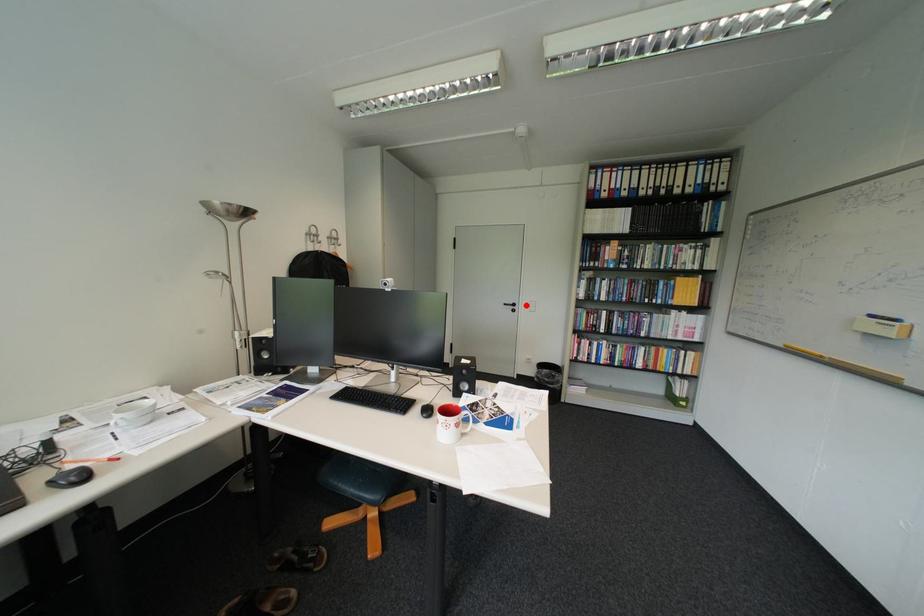
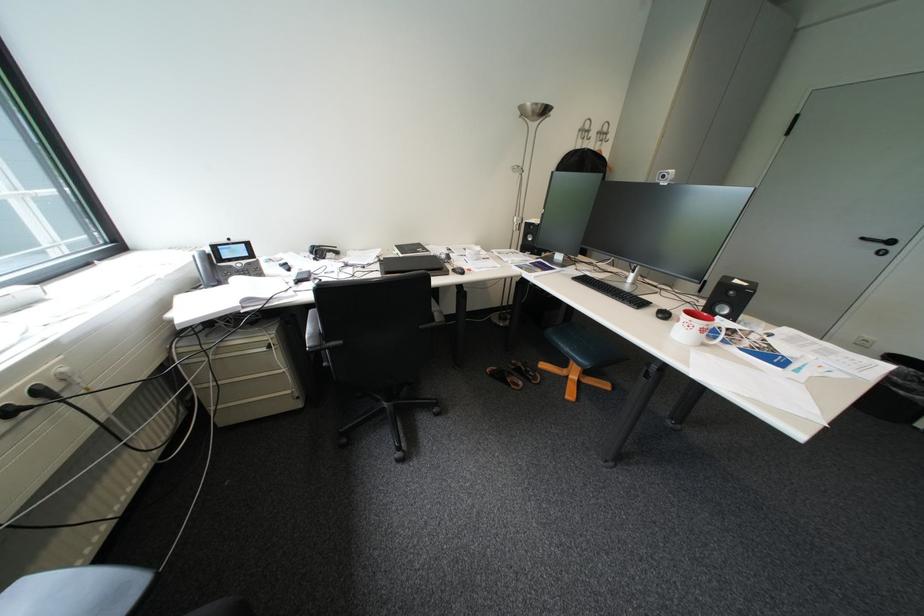
Question: A red point is marked in image1. In image2, is the corresponding 3D point closer to the camera or farther? Reply with the corresponding letter.

Choices:
 (A) The corresponding 3D point is closer.
 (B) The corresponding 3D point is farther.

Answer: (B)